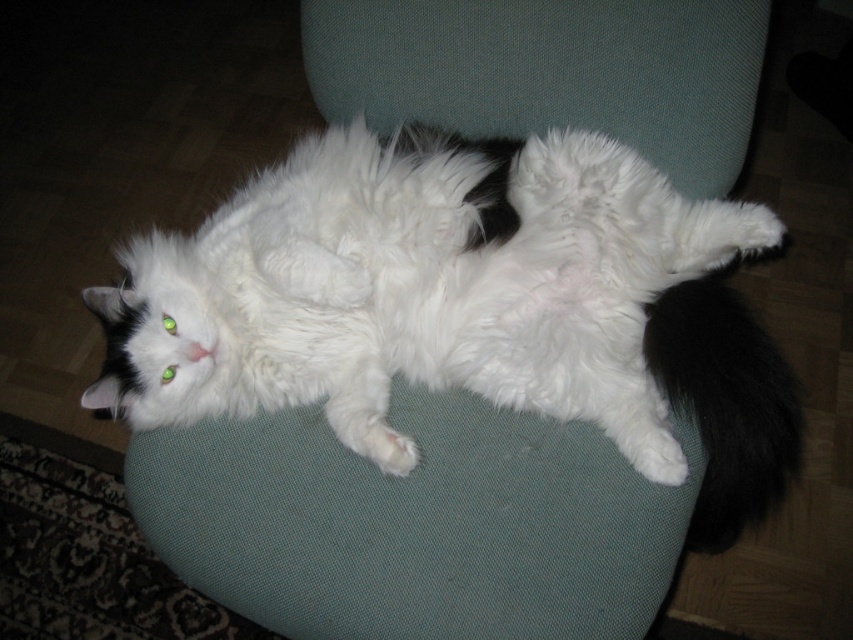
Is white fluffy cat at center wider than black fluffy tail at lower right?

Correct, the width of white fluffy cat at center exceeds that of black fluffy tail at lower right.

Can you confirm if white fluffy cat at center is bigger than black fluffy tail at lower right?

Yes.

Where is `white fluffy cat at center`? This screenshot has width=853, height=640. white fluffy cat at center is located at coordinates (463, 305).

Is white fluffy cat at center further to camera compared to white fluffy cushion at center?

No.

In the scene shown: Who is lower down, white fluffy cat at center or white fluffy cushion at center?

white fluffy cat at center is below.

Who is more distant from viewer, (515,198) or (520,1)?

The point (520,1) is behind.

Locate an element on the screen. white fluffy cat at center is located at coordinates (463, 305).

Does white fluffy cushion at center have a larger size compared to black fluffy tail at lower right?

Incorrect, white fluffy cushion at center is not larger than black fluffy tail at lower right.

Is white fluffy cushion at center closer to the viewer compared to black fluffy tail at lower right?

No.

Who is more distant from viewer, (x=433, y=74) or (x=714, y=532)?

Positioned behind is point (x=714, y=532).

Identify the location of white fluffy cushion at center. This screenshot has width=853, height=640. (550, 72).